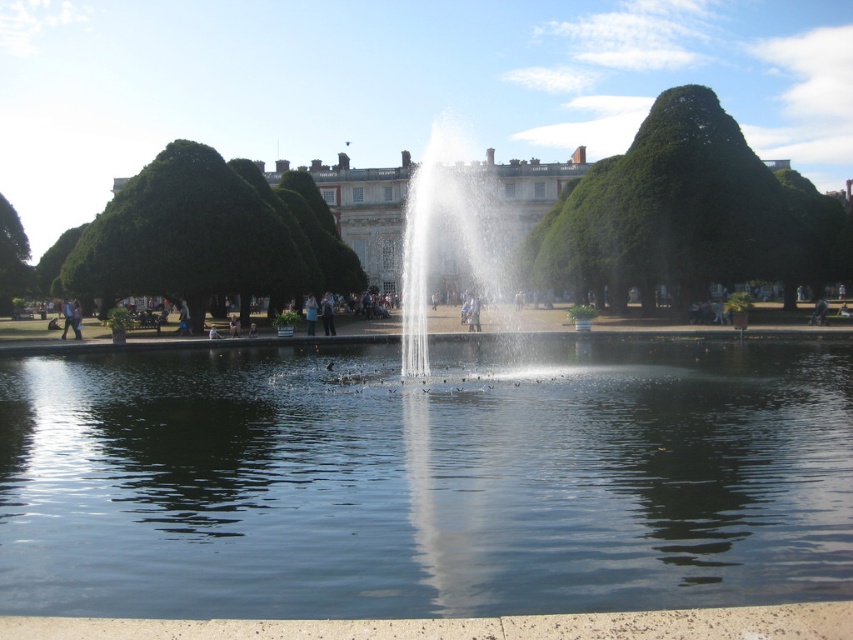
You are a tourist standing at the edge of the park and want to take a photo of both the matte white palace at center and the light brown wooden statue at center. Which one should you focus on first if you want to capture both in the frame without moving your camera?

You should focus on the matte white palace at center first because it is taller than the light brown wooden statue at center, allowing both to fit within the frame by adjusting the camera angle accordingly.

You are a photographer planning to take a picture of the fountain. You want to include both the green leafy tree at upper left and the dark blue jeans at center in your frame. Which object will appear bigger in the photo?

The green leafy tree at upper left will appear bigger in the photo because it has a larger size compared to the dark blue jeans at center.

You are a photographer standing in the park and want to capture both the green leafy tree at upper left and the dark blue jeans at center in your photo. Which object will appear larger in the photo?

The green leafy tree at upper left will appear larger in the photo because it is much taller than the dark blue jeans at center.